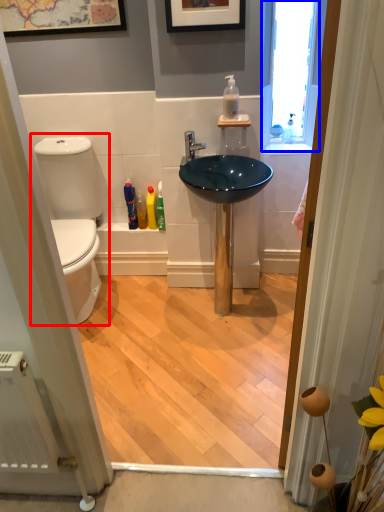
Question: Among these objects, which one is farthest to the camera, toilet (highlighted by a red box) or window (highlighted by a blue box)?

Choices:
 (A) toilet
 (B) window

Answer: (B)